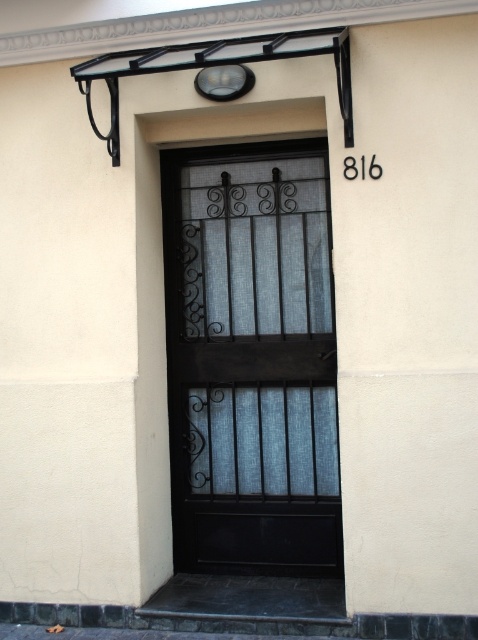
Question: Considering the relative positions of black wrought iron door at center and matte glass light fixture at upper center in the image provided, where is black wrought iron door at center located with respect to matte glass light fixture at upper center?

Choices:
 (A) left
 (B) right

Answer: (B)

Question: Can you confirm if black wrought iron door at center is positioned to the right of matte glass light fixture at upper center?

Choices:
 (A) no
 (B) yes

Answer: (B)

Question: Is black wrought iron door at center thinner than matte glass light fixture at upper center?

Choices:
 (A) no
 (B) yes

Answer: (A)

Question: Which of the following is the closest to the observer?

Choices:
 (A) black wrought iron door at center
 (B) matte glass light fixture at upper center

Answer: (B)